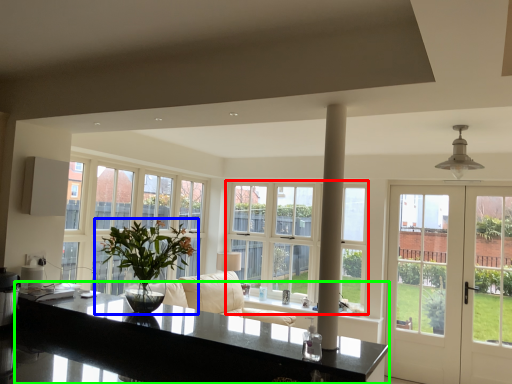
Question: Which object is the farthest from window (highlighted by a red box)? Choose among these: houseplant (highlighted by a blue box) or countertop (highlighted by a green box).

Choices:
 (A) houseplant
 (B) countertop

Answer: (B)